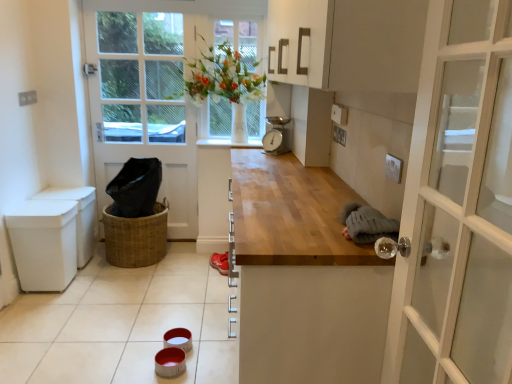
Question: Looking at their shapes, would you say white glossy tile at lower center is wider or thinner than woven brown basket at lower left?

Choices:
 (A) thin
 (B) wide

Answer: (B)

Question: Considering the positions of white glossy tile at lower center and woven brown basket at lower left in the image, is white glossy tile at lower center bigger or smaller than woven brown basket at lower left?

Choices:
 (A) big
 (B) small

Answer: (A)

Question: Which object is positioned closest to the white glossy tile at lower center?

Choices:
 (A) translucent glass window at center
 (B) white wooden door at left
 (C) white plastic bin at left
 (D) woven brown basket at lower left
 (E) metallic gray scale at upper center

Answer: (D)

Question: Considering the real-world distances, which object is closest to the metallic gray scale at upper center?

Choices:
 (A) translucent glass window at center
 (B) white wooden door at left
 (C) white glossy tile at lower center
 (D) white plastic bin at left
 (E) woven brown basket at lower left

Answer: (A)